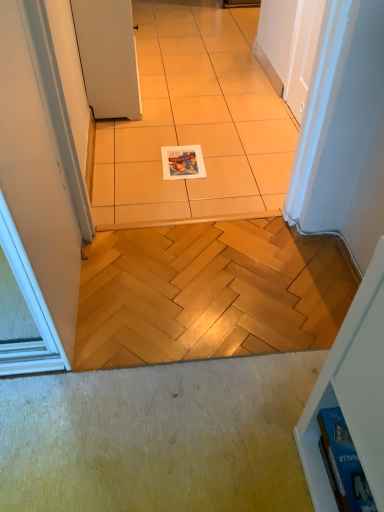
Find the location of a particular element. Image resolution: width=384 pixels, height=512 pixels. vacant space in front of matte paper magazine at center, which is the 2th magazine from front to back is located at coordinates (186, 195).